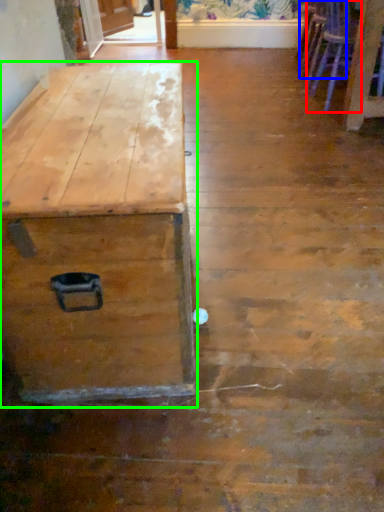
Question: Which object is the closest to the armchair (highlighted by a red box)? Choose among these: armchair (highlighted by a blue box) or table (highlighted by a green box).

Choices:
 (A) armchair
 (B) table

Answer: (A)